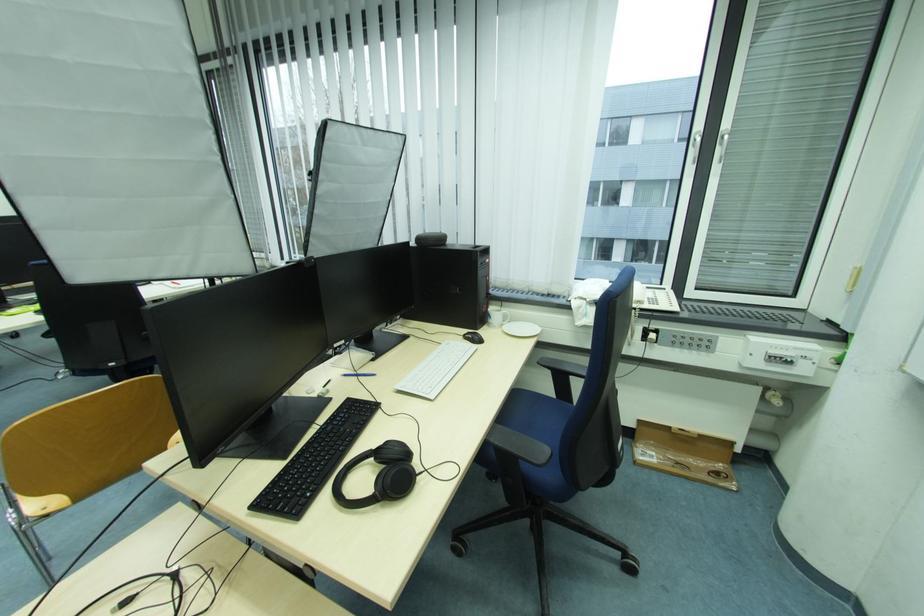
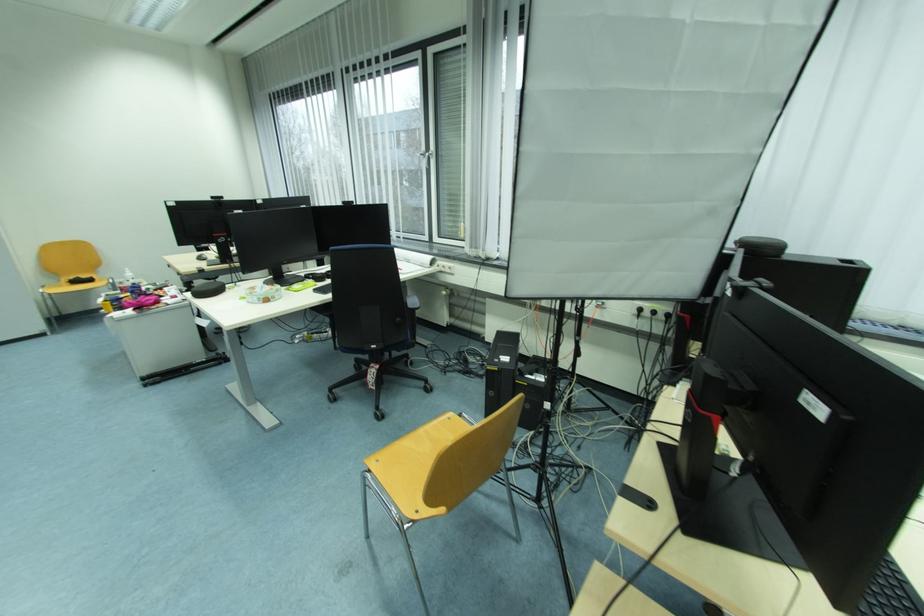
Question: In a continuous first-person perspective shot, in which direction is the camera moving?

Choices:
 (A) Left
 (B) Right
 (C) Forward
 (D) Backward

Answer: (A)